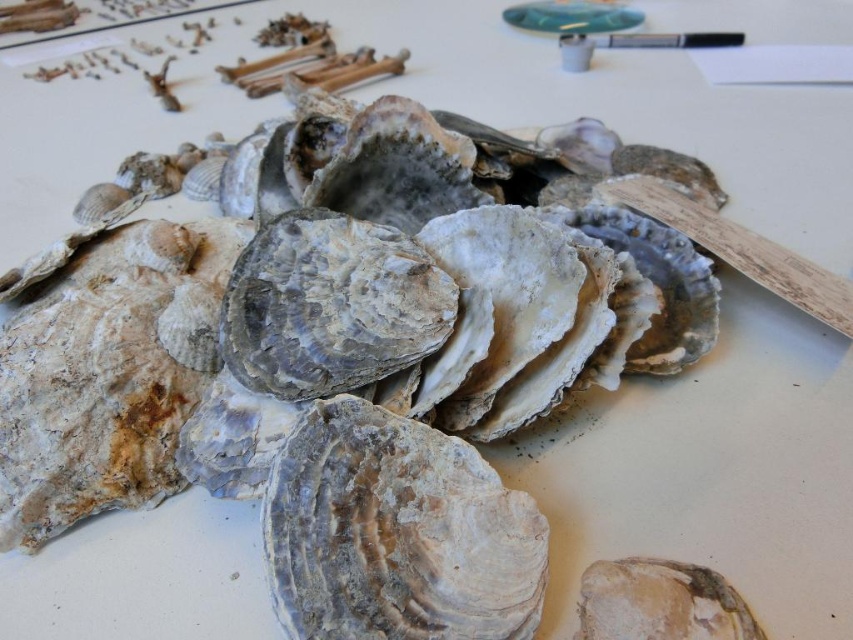
Question: Is rough textured shell at center positioned in front of speckled stone shell at center?

Choices:
 (A) yes
 (B) no

Answer: (B)

Question: Which of these objects is positioned farthest from the gray textured shell at center?

Choices:
 (A) rough textured shell at center
 (B) speckled stone shell at center

Answer: (B)

Question: Estimate the real-world distances between objects in this image. Which object is farther from the rough textured shell at center?

Choices:
 (A) gray textured shell at center
 (B) speckled stone shell at center

Answer: (B)

Question: Is gray textured shell at center behind speckled stone shell at center?

Choices:
 (A) yes
 (B) no

Answer: (A)

Question: Estimate the real-world distances between objects in this image. Which object is farther from the speckled stone shell at center?

Choices:
 (A) gray textured shell at center
 (B) rough textured shell at center

Answer: (B)

Question: Is rough textured shell at center to the left of speckled stone shell at center from the viewer's perspective?

Choices:
 (A) yes
 (B) no

Answer: (A)